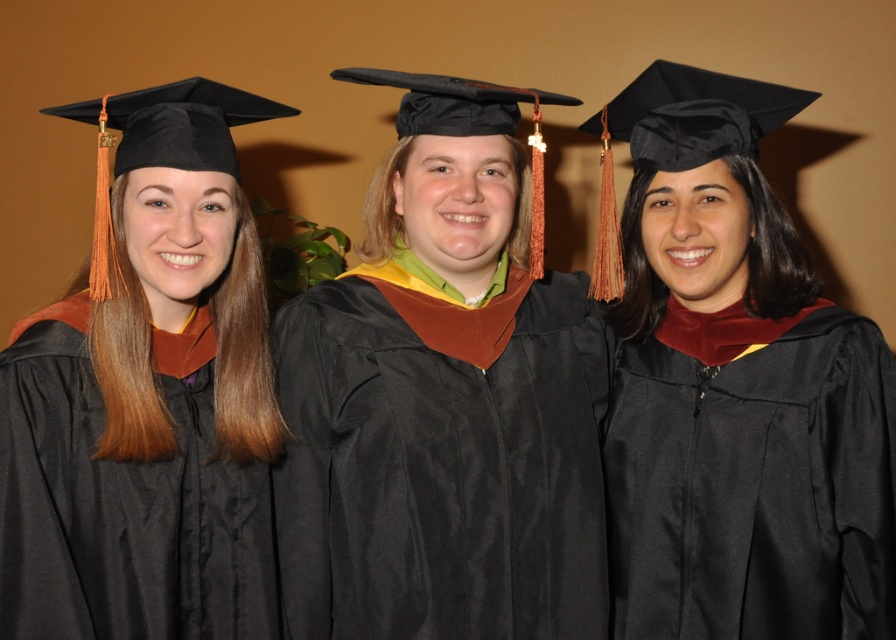
Measure the distance between satin black graduation gown at center and camera.

The distance of satin black graduation gown at center from camera is 4.33 feet.

Who is more distant from viewer, (334,577) or (864,412)?

The point (334,577) is more distant.

Where is `satin black graduation gown at center`? satin black graduation gown at center is located at coordinates (444, 401).

Between point (777, 609) and point (177, 356), which one is positioned in front?

Point (777, 609) is in front.

Does point (767, 90) come in front of point (142, 332)?

No, it is behind (142, 332).

You are a GUI agent. You are given a task and a screenshot of the screen. Output one action in this format:
    pyautogui.click(x=<x>, y=<y>)
    Task: Click on the black matte graduation gown at center
    This screenshot has height=640, width=896.
    Given the screenshot: What is the action you would take?
    pyautogui.click(x=737, y=390)

Identify the location of black matte graduation gown at center. (737, 390).

Is satin black graduation gown at center smaller than matte black graduation gown at left?

No, satin black graduation gown at center is not smaller than matte black graduation gown at left.

At what (x,y) coordinates should I click in order to perform the action: click on satin black graduation gown at center. Please return your answer as a coordinate pair (x, y). Looking at the image, I should click on (444, 401).

Identify the location of satin black graduation gown at center. This screenshot has width=896, height=640. (444, 401).